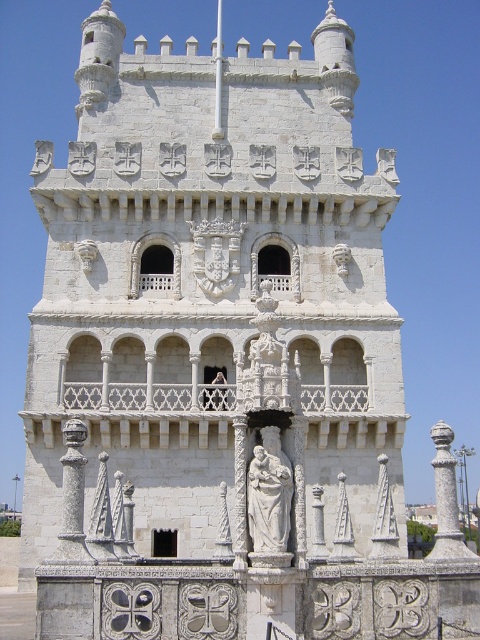
From the picture: You are an architect examining the historic stone tower. You notice two statues at the center of the third level. The first is labeled as a white marble statue at center, and the second is labeled as a white stone statue at center. Which of these two statues is shorter?

The white marble statue at center is shorter than the white stone statue at center.

You are standing at a point 35.29 meters away from the historic stone tower. If you want to take a photo of the tower, which part of the tower will be in focus if your camera is focused on the point at coordinates point (273,429)?

The point at coordinates point (273,429) is 35.29 meters away from the camera, so focusing on this point will ensure the area around it, likely the central ornate statue on the third level of the tower, is in focus.